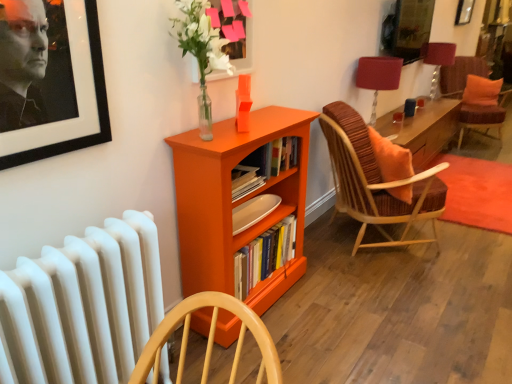
At what (x,y) coordinates should I click in order to perform the action: click on vacant point above orange matte bookcase at center (from a real-world perspective). Please return your answer as a coordinate pair (x, y). The width and height of the screenshot is (512, 384). Looking at the image, I should click on (250, 126).